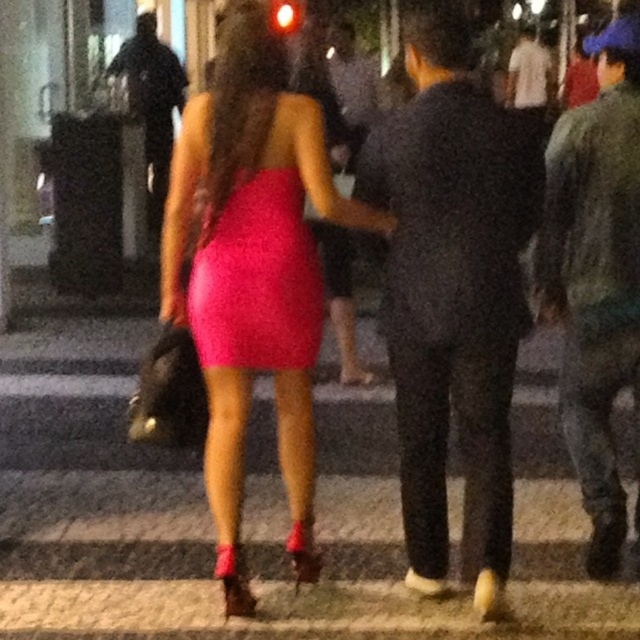
You are a photographer trying to capture the shiny pink dress at center and the black leather jacket at upper left in a new photo. Based on their size in the current image, which object should you focus on to ensure it takes up more of the frame?

The black leather jacket at upper left should be focused on because it occupies more space in the frame compared to the shiny pink dress at center.

You are a photographer trying to capture a detailed shot of both the shiny pink dress at center and the black leather jacket at upper left. Given that your camera can only focus on objects wider than 30 cm, will both items be in focus?

The shiny pink dress at center is narrower than the black leather jacket at upper left. Since the camera requires objects wider than 30 cm to focus, only the black leather jacket at upper left will be in focus if it meets the width requirement. The shiny pink dress at center may not be wide enough.